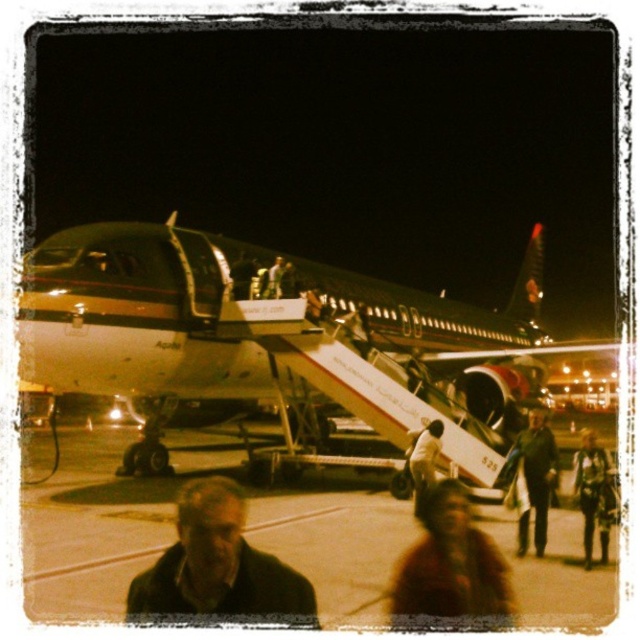
Question: Among these objects, which one is nearest to the camera?

Choices:
 (A) dark brown leather jacket at lower center
 (B) white metallic airplane at center
 (C) dark brown leather jacket at center

Answer: (A)

Question: In this image, where is dark brown leather jacket at lower center located relative to brown fuzzy coat at lower center?

Choices:
 (A) right
 (B) left

Answer: (B)

Question: Is white metallic airplane at center bigger than brown fuzzy coat at lower center?

Choices:
 (A) no
 (B) yes

Answer: (B)

Question: Which point is farther to the camera?

Choices:
 (A) white metallic airplane at center
 (B) dark brown leather jacket at lower right
 (C) brown fuzzy coat at lower center

Answer: (A)

Question: Which point is closer to the camera?

Choices:
 (A) smooth concrete tarmac at center
 (B) dark brown leather jacket at center

Answer: (A)

Question: Can you confirm if white metallic airplane at center is smaller than dark brown leather jacket at lower center?

Choices:
 (A) no
 (B) yes

Answer: (A)